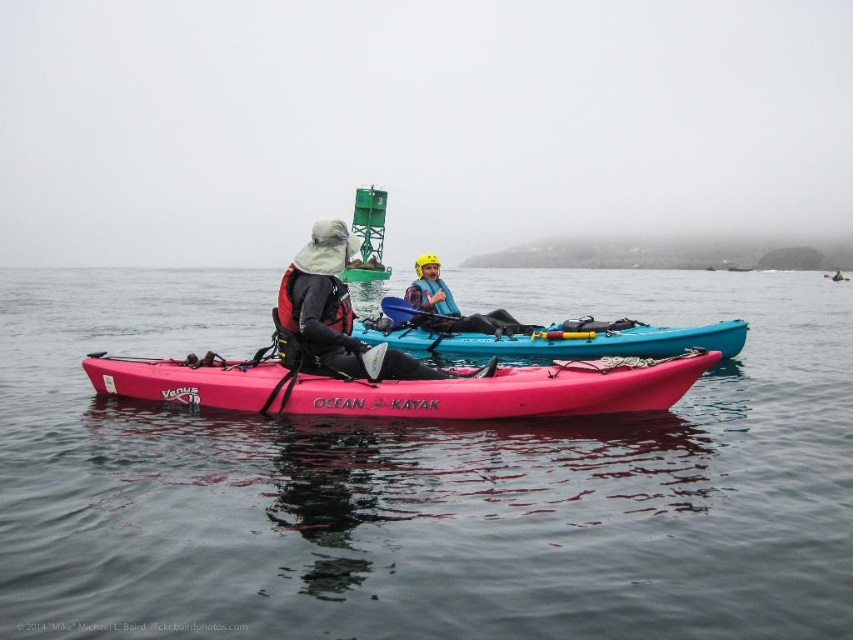
Question: Estimate the real-world distances between objects in this image. Which object is farther from the blue fabric life jacket at center?

Choices:
 (A) yellow helmet at center
 (B) matte black kayak at center
 (C) teal glossy kayak at center
 (D) matte black jacket at center

Answer: (B)

Question: Which object is farther from the camera taking this photo?

Choices:
 (A) teal glossy kayak at center
 (B) yellow helmet at center
 (C) blue fabric life jacket at center
 (D) matte black jacket at center

Answer: (C)

Question: Considering the relative positions of smooth dark water at center and matte black kayak at center in the image provided, where is smooth dark water at center located with respect to matte black kayak at center?

Choices:
 (A) above
 (B) below

Answer: (B)

Question: Can you confirm if matte black jacket at center is thinner than matte black kayak at center?

Choices:
 (A) no
 (B) yes

Answer: (B)

Question: Which point is closer to the camera?

Choices:
 (A) matte black jacket at center
 (B) red matte life jacket at center
 (C) teal glossy kayak at center

Answer: (A)

Question: Is smooth dark water at center above yellow helmet at center?

Choices:
 (A) yes
 (B) no

Answer: (A)